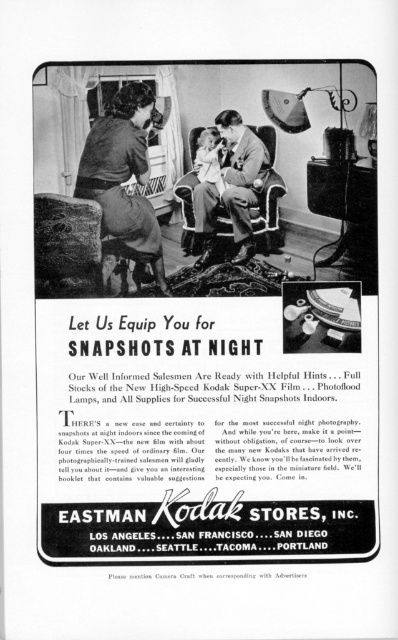
Question: Which of the following is the closest to the observer?

Choices:
 (A) matte black suit at center
 (B) matte black dress at upper left

Answer: (B)

Question: Is matte black dress at upper left positioned at the back of matte black suit at center?

Choices:
 (A) yes
 (B) no

Answer: (B)

Question: Is matte black dress at upper left to the right of matte black suit at center from the viewer's perspective?

Choices:
 (A) yes
 (B) no

Answer: (B)

Question: From the image, what is the correct spatial relationship of matte black dress at upper left in relation to matte black suit at center?

Choices:
 (A) below
 (B) above

Answer: (A)

Question: Which of the following is the farthest from the observer?

Choices:
 (A) matte black dress at upper left
 (B) matte black suit at center

Answer: (B)